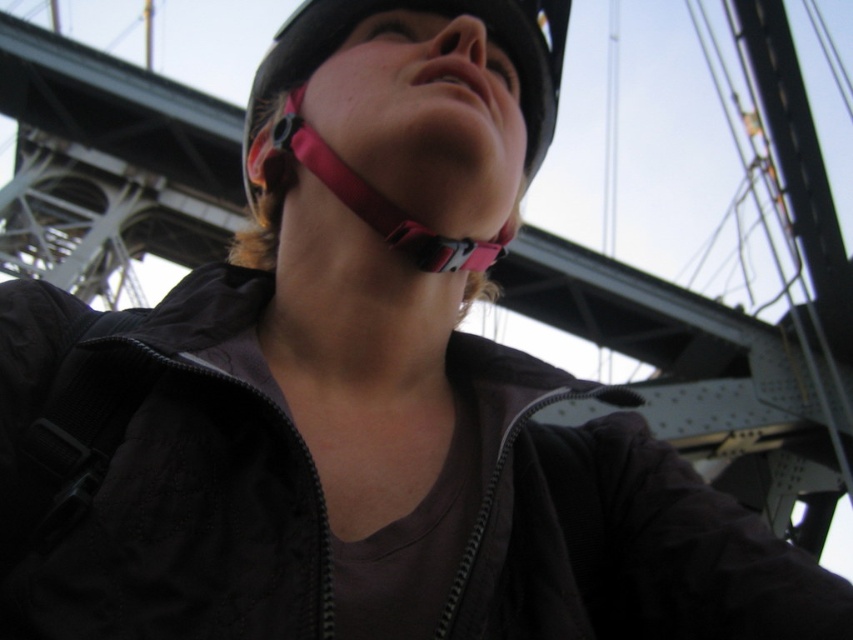
Question: Does black matte helmet at upper center appear on the right side of pink fabric strap at center?

Choices:
 (A) no
 (B) yes

Answer: (B)

Question: From the image, what is the correct spatial relationship of black matte helmet at upper center in relation to pink fabric strap at center?

Choices:
 (A) right
 (B) left

Answer: (A)

Question: Among these objects, which one is nearest to the camera?

Choices:
 (A) black matte helmet at upper center
 (B) pink fabric strap at center

Answer: (B)

Question: Which point is farther to the camera?

Choices:
 (A) (521, 64)
 (B) (289, 154)

Answer: (A)

Question: Is black matte helmet at upper center below pink fabric strap at center?

Choices:
 (A) no
 (B) yes

Answer: (A)